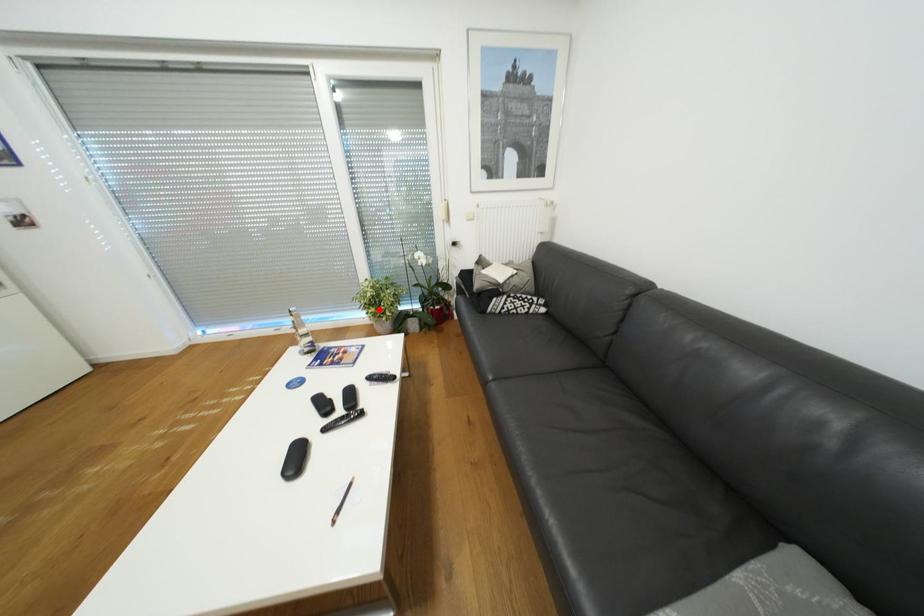
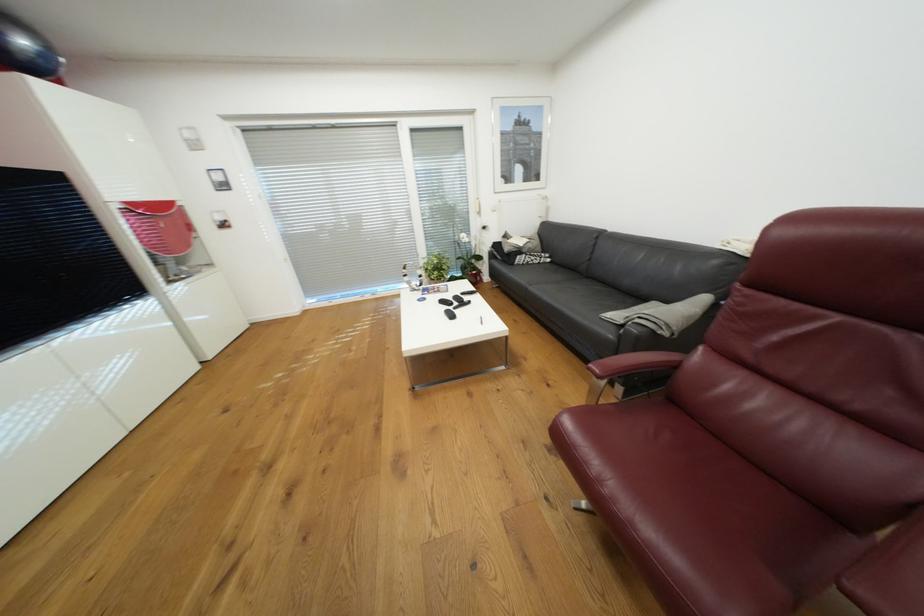
Question: I am providing you with two images of the same scene from different viewpoints. A red point is shown in image1. For the corresponding object point in image2, is it positioned nearer or farther from the camera?

Choices:
 (A) Nearer
 (B) Farther

Answer: (A)